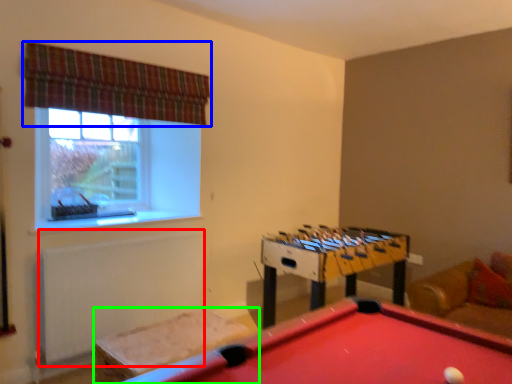
Question: Estimate the real-world distances between objects in this image. Which object is closer to radiator (highlighted by a red box), curtain (highlighted by a blue box) or furniture (highlighted by a green box)?

Choices:
 (A) curtain
 (B) furniture

Answer: (B)